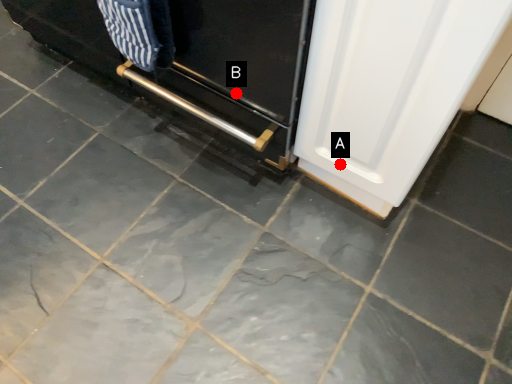
Question: Two points are circled on the image, labeled by A and B beside each circle. Which point is closer to the camera taking this photo?

Choices:
 (A) A is closer
 (B) B is closer

Answer: (B)